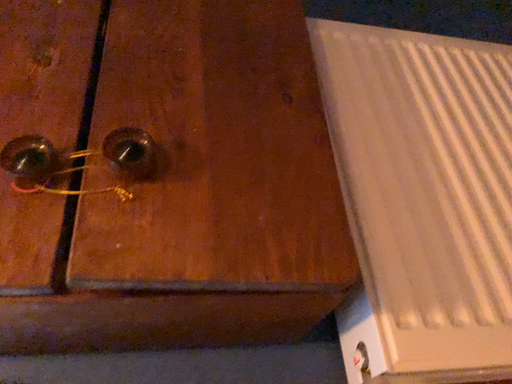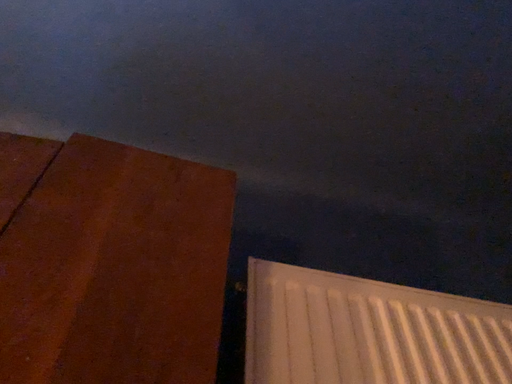
Question: How did the camera likely rotate when shooting the video?

Choices:
 (A) rotated downward
 (B) rotated upward

Answer: (B)